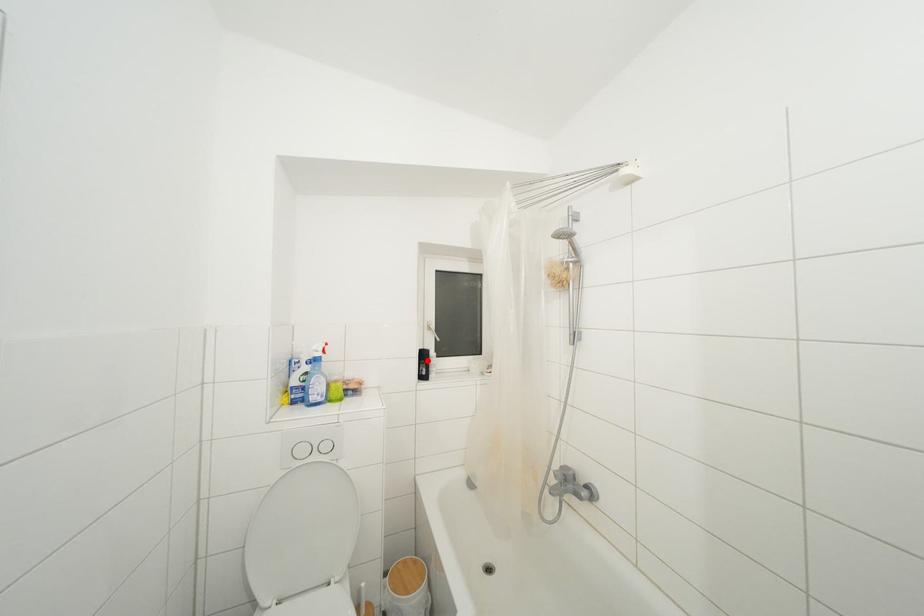
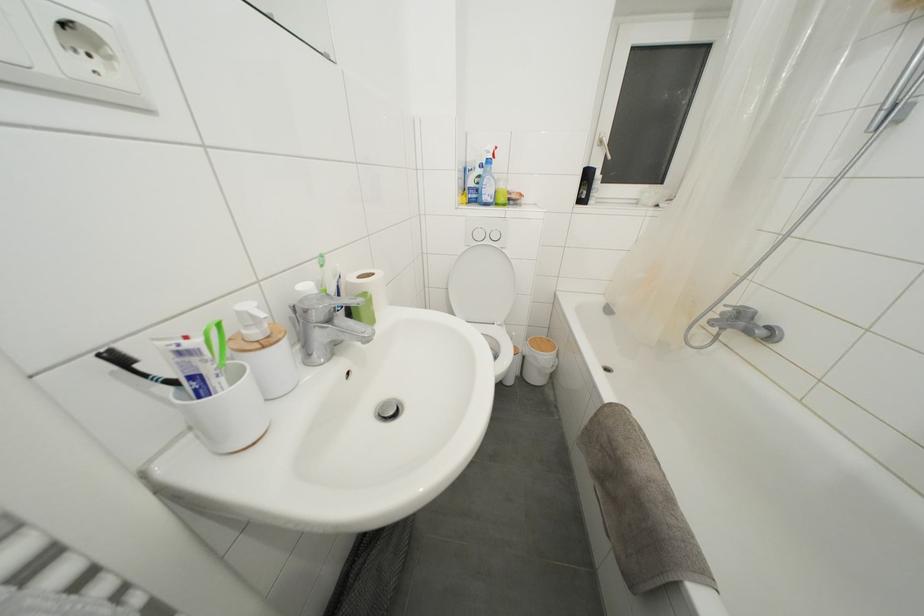
Locate, in the second image, the point that corresponds to the highlighted location in the first image.

(591, 180)